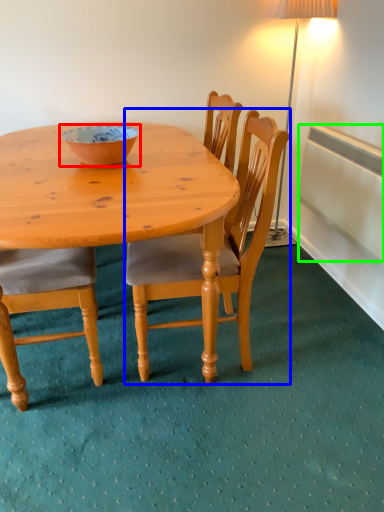
Question: Estimate the real-world distances between objects in this image. Which object is closer to bowl (highlighted by a red box), chair (highlighted by a blue box) or radiator (highlighted by a green box)?

Choices:
 (A) chair
 (B) radiator

Answer: (A)